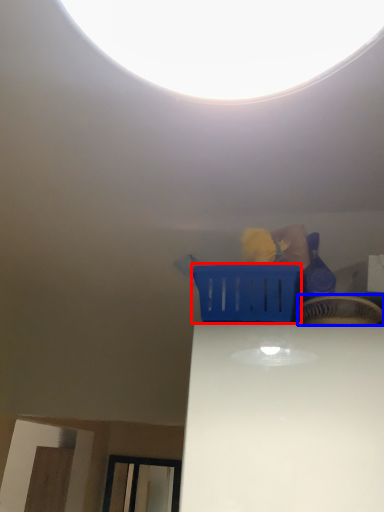
Question: Which object appears closest to the camera in this image, basket (highlighted by a red box) or basket (highlighted by a blue box)?

Choices:
 (A) basket
 (B) basket

Answer: (B)